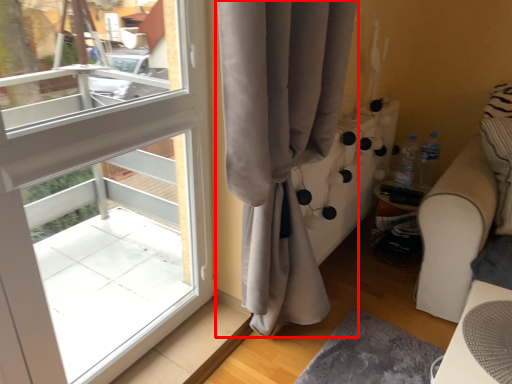
Question: Observing the image, what is the correct spatial positioning of curtain (annotated by the red box) in reference to table?

Choices:
 (A) left
 (B) right

Answer: (A)